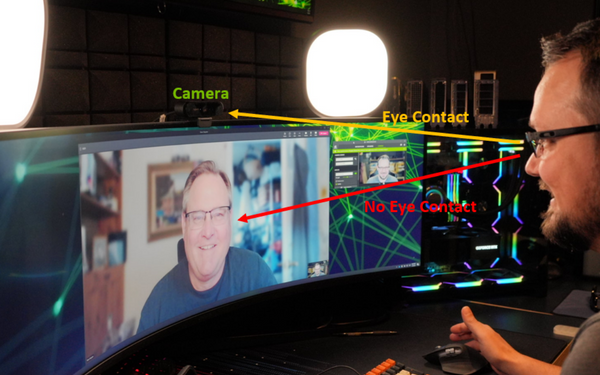
The width and height of the screenshot is (600, 375). I want to click on computer screen, so click(x=131, y=240), click(x=373, y=163).